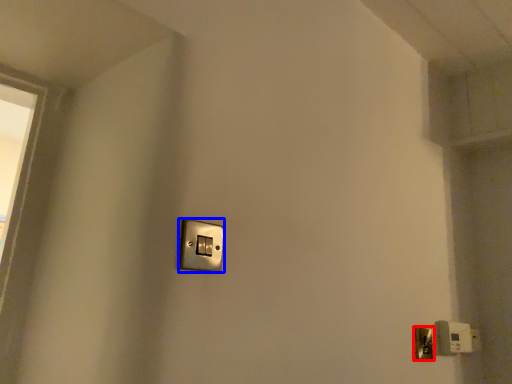
Question: Which object appears closest to the camera in this image, door handle (highlighted by a red box) or light switch (highlighted by a blue box)?

Choices:
 (A) door handle
 (B) light switch

Answer: (B)